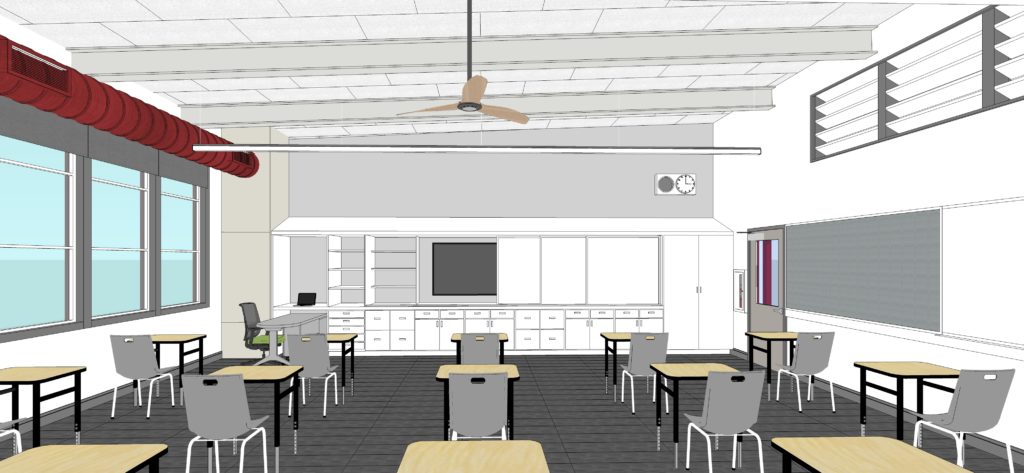
Find the location of `clock`. clock is located at coordinates (684, 184).